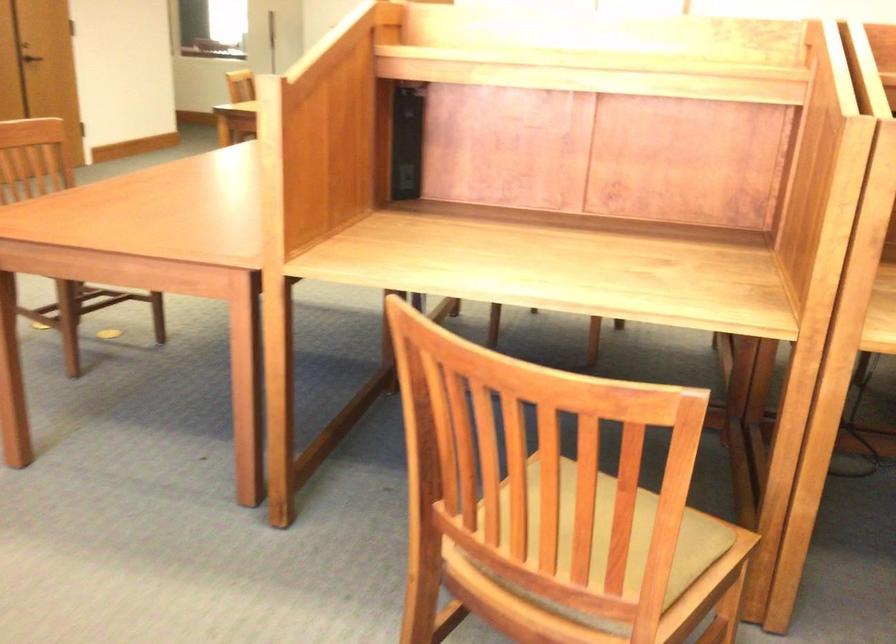
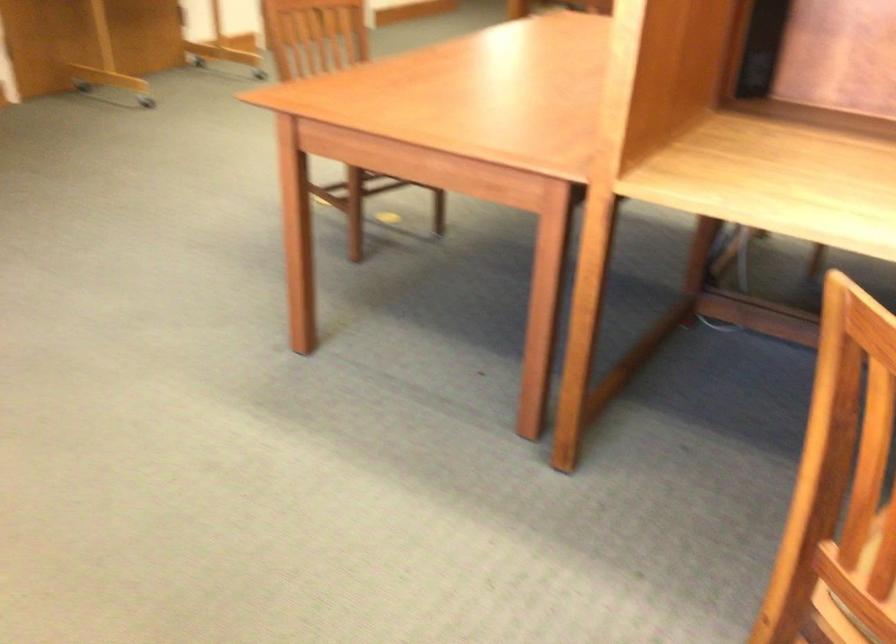
Question: The camera is either moving clockwise (left) or counter-clockwise (right) around the object. The first image is from the beginning of the video and the second image is from the end. Is the camera moving left or right when shooting the video?

Choices:
 (A) Left
 (B) Right

Answer: (B)